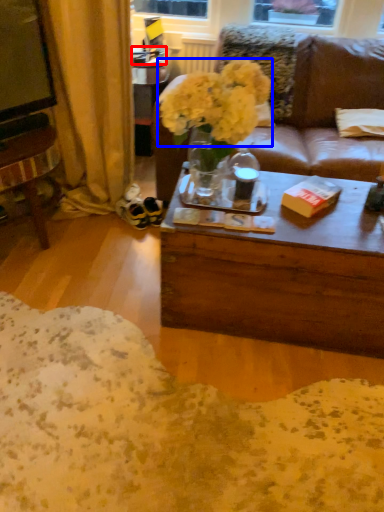
Question: Which object is further to the camera taking this photo, box (highlighted by a red box) or flower (highlighted by a blue box)?

Choices:
 (A) box
 (B) flower

Answer: (A)